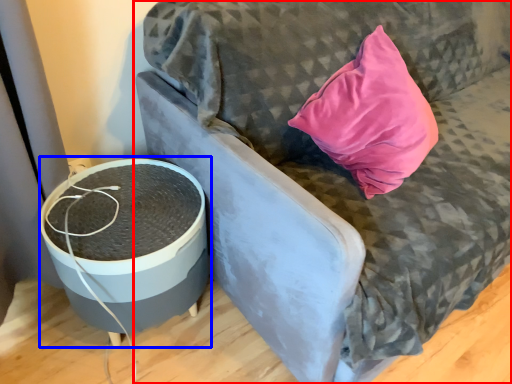
Question: Which object appears farthest to the camera in this image, furniture (highlighted by a red box) or round table (highlighted by a blue box)?

Choices:
 (A) furniture
 (B) round table

Answer: (B)